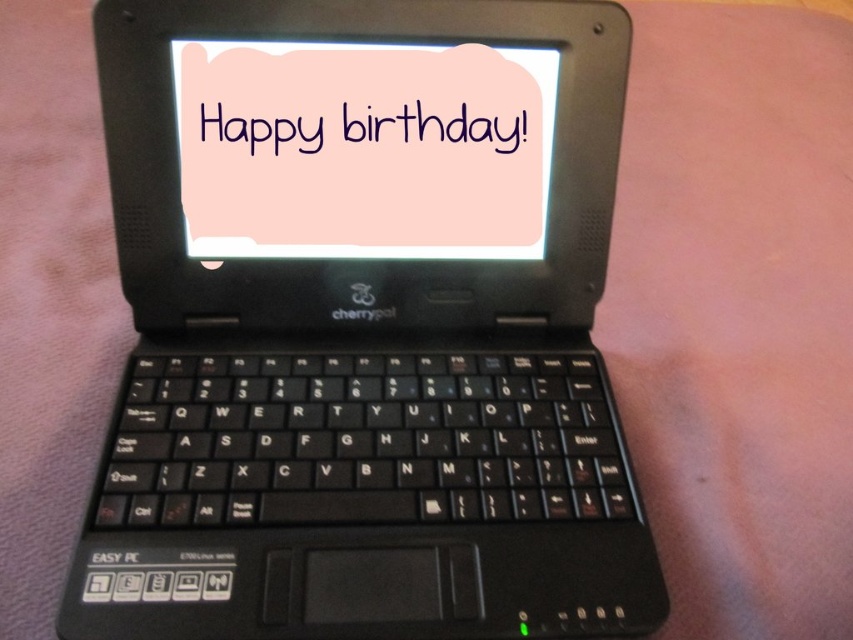
Between black plastic laptop at center and pink matte card at center, which one appears on the right side from the viewer's perspective?

Positioned to the right is black plastic laptop at center.

Between black plastic laptop at center and pink matte card at center, which one has more height?

With more height is black plastic laptop at center.

Is point (654, 552) behind point (258, 237)?

No, (654, 552) is closer to viewer.

This screenshot has height=640, width=853. Identify the location of black plastic laptop at center. (363, 324).